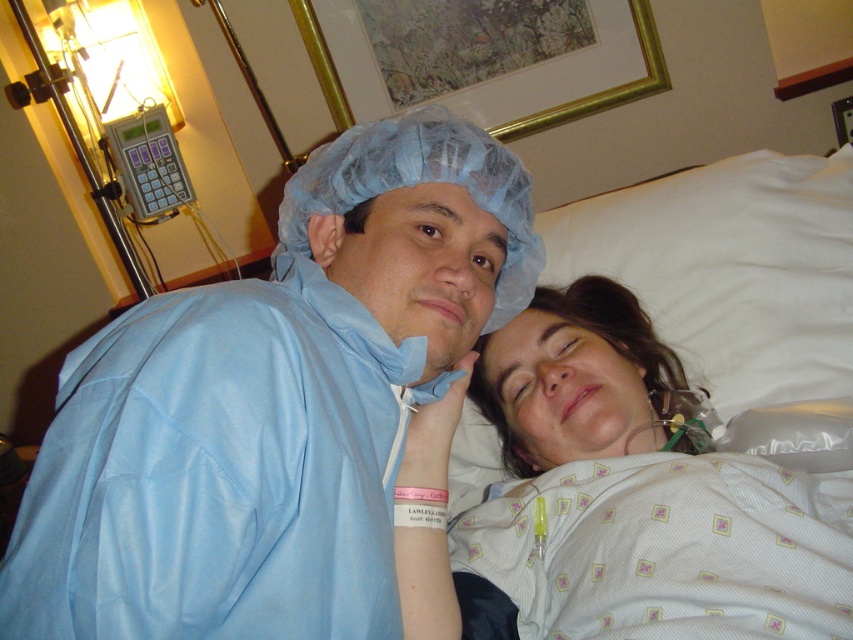
Question: Does blue matte hospital gown at left have a larger size compared to white textured hospital gown at center?

Choices:
 (A) no
 (B) yes

Answer: (B)

Question: Does blue matte hospital gown at left come behind white textured hospital gown at center?

Choices:
 (A) yes
 (B) no

Answer: (B)

Question: Is blue matte hospital gown at left to the right of white textured hospital gown at center from the viewer's perspective?

Choices:
 (A) no
 (B) yes

Answer: (A)

Question: Which point is closer to the camera taking this photo?

Choices:
 (A) (123, 324)
 (B) (799, 620)

Answer: (A)